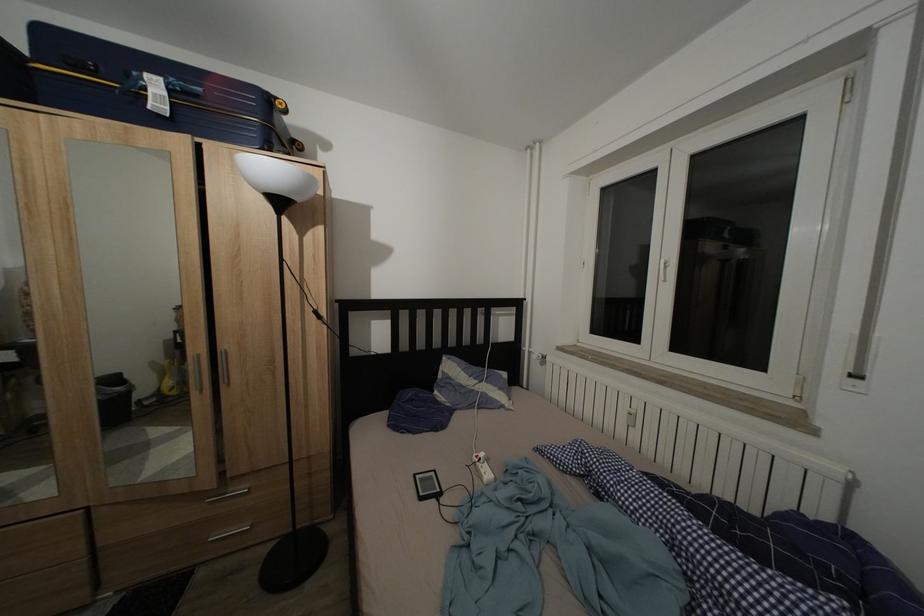
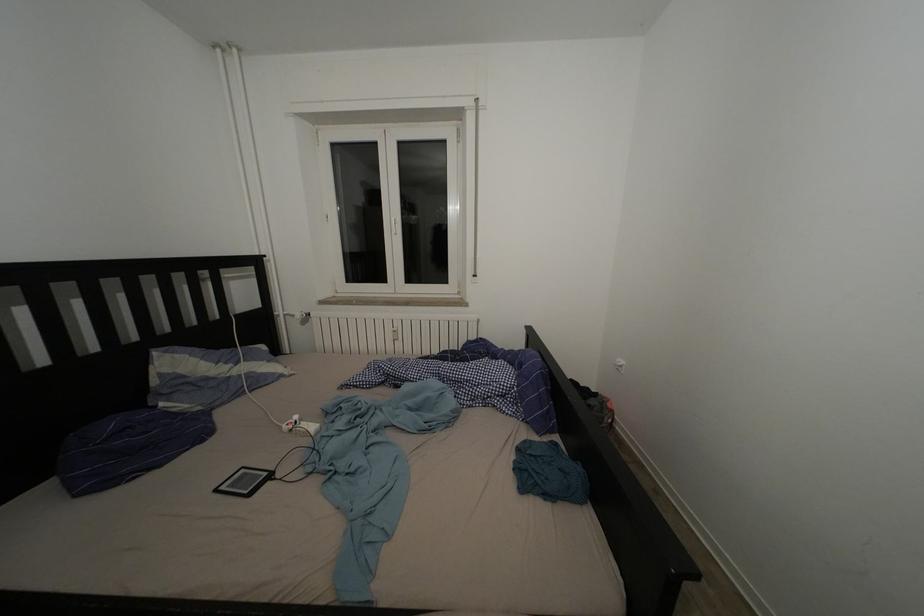
Question: The camera is either moving clockwise (left) or counter-clockwise (right) around the object. The first image is from the beginning of the video and the second image is from the end. Is the camera moving left or right when shooting the video?

Choices:
 (A) Left
 (B) Right

Answer: (A)